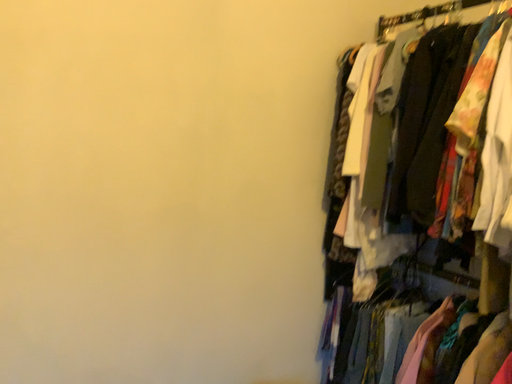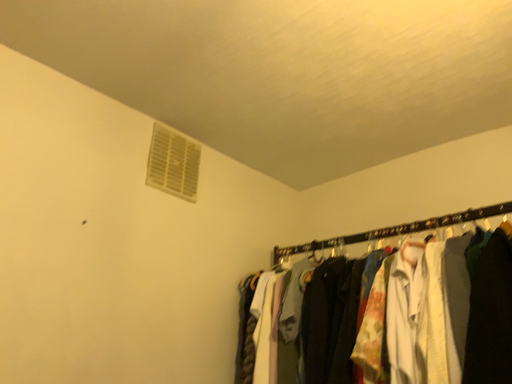
Question: Which way did the camera rotate in the video?

Choices:
 (A) rotated right
 (B) rotated left

Answer: (A)